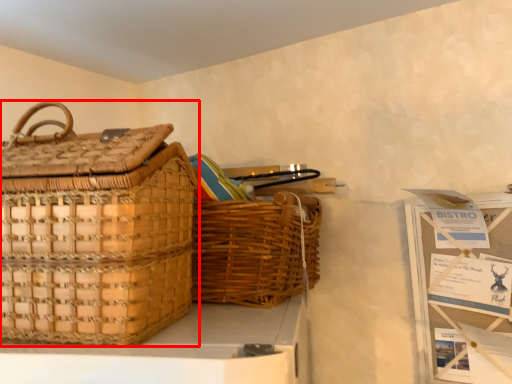
Question: From the image's perspective, where is picnic basket (annotated by the red box) located relative to picnic basket?

Choices:
 (A) above
 (B) below

Answer: (A)